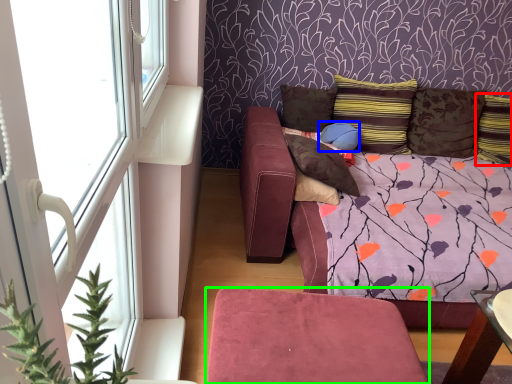
Question: Which object is the closest to the pillow (highlighted by a red box)? Choose among these: pillow (highlighted by a blue box) or furniture (highlighted by a green box).

Choices:
 (A) pillow
 (B) furniture

Answer: (A)